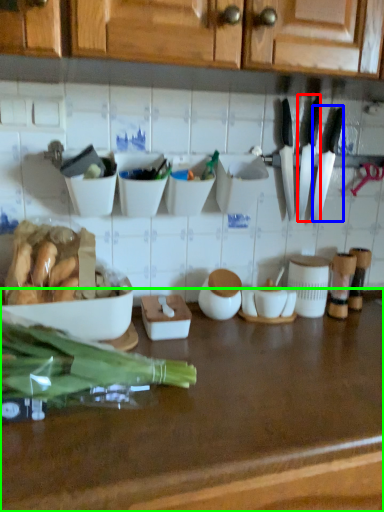
Question: Considering the real-world distances, which object is closest to kitchen knife (highlighted by a red box)? kitchen knife (highlighted by a blue box) or countertop (highlighted by a green box).

Choices:
 (A) kitchen knife
 (B) countertop

Answer: (A)